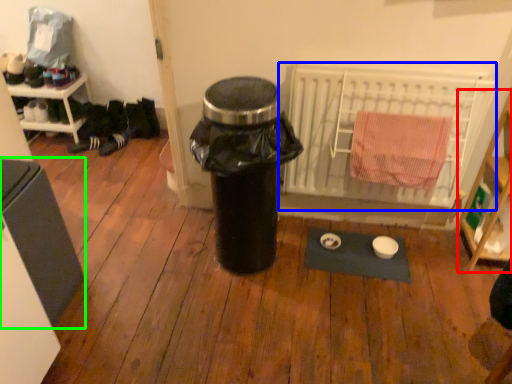
Question: Which is nearer to the shelf (highlighted by a red box)? radiator (highlighted by a blue box) or furniture (highlighted by a green box).

Choices:
 (A) radiator
 (B) furniture

Answer: (A)